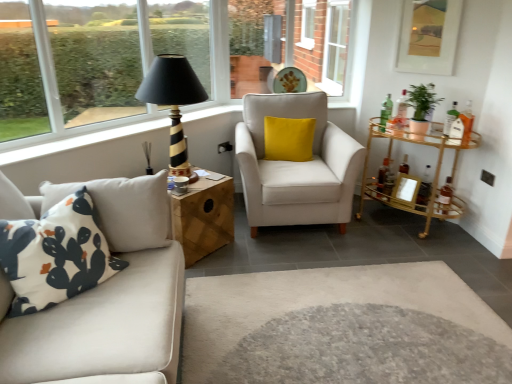
Measure the distance between yellow velvet pillow at center, which is the 2th pillow from left to right, and camera.

3.37 meters.

You are a GUI agent. You are given a task and a screenshot of the screen. Output one action in this format:
    pyautogui.click(x=<x>, y=<y>)
    Task: Click on the gold metallic bar cart at right, which is the 2th table in left-to-right order
    Image resolution: width=512 pixels, height=384 pixels.
    Given the screenshot: What is the action you would take?
    pyautogui.click(x=415, y=177)

This screenshot has width=512, height=384. Find the location of `wooden picture frame at right, arranged as the first picture frame when ordered from the bottom`. wooden picture frame at right, arranged as the first picture frame when ordered from the bottom is located at coordinates (405, 190).

Measure the distance between point (x=411, y=124) and camera.

Point (x=411, y=124) is 3.10 meters away from camera.

The height and width of the screenshot is (384, 512). I want to click on yellow velvet pillow at center, acting as the 2th pillow starting from the front, so click(x=289, y=139).

Can you confirm if green matte plant at upper right is bigger than wooden picture frame at right, acting as the 2th picture frame starting from the top?

Yes, green matte plant at upper right is bigger than wooden picture frame at right, acting as the 2th picture frame starting from the top.

From a real-world perspective, does green matte plant at upper right sit lower than wooden picture frame at right, arranged as the first picture frame when ordered from the bottom?

No, from a real-world perspective, green matte plant at upper right is not under wooden picture frame at right, arranged as the first picture frame when ordered from the bottom.

Is green matte plant at upper right not inside wooden picture frame at right, arranged as the first picture frame when ordered from the bottom?

Yes, green matte plant at upper right is outside of wooden picture frame at right, arranged as the first picture frame when ordered from the bottom.

Is there a large distance between green matte plant at upper right and wooden picture frame at right, arranged as the first picture frame when ordered from the bottom?

They are positioned close to each other.

Between white glass window at upper right, which ranks as the 2th window in back-to-front order, and wooden picture frame at right, acting as the 2th picture frame starting from the top, which one appears on the left side from the viewer's perspective?

white glass window at upper right, which ranks as the 2th window in back-to-front order.

Considering the positions of objects white glass window at upper right, which ranks as the 2th window in back-to-front order, and wooden picture frame at right, acting as the 2th picture frame starting from the top, in the image provided, who is in front, white glass window at upper right, which ranks as the 2th window in back-to-front order, or wooden picture frame at right, acting as the 2th picture frame starting from the top,?

wooden picture frame at right, acting as the 2th picture frame starting from the top.

Does point (346, 7) come farther from viewer compared to point (396, 184)?

Yes, point (346, 7) is farther from viewer.

Is wooden cube at center, the first table when ordered from left to right, at the back of black striped wood table lamp at upper center?

No, black striped wood table lamp at upper center's orientation is not away from wooden cube at center, the first table when ordered from left to right.

Looking at this image, from the image's perspective, which one is positioned lower, black striped wood table lamp at upper center or wooden cube at center, the first table when ordered from left to right?

From the image's view, wooden cube at center, the first table when ordered from left to right, is below.

Is black striped wood table lamp at upper center wider or thinner than wooden cube at center, the first table when ordered from left to right?

In the image, black striped wood table lamp at upper center appears to be more narrow than wooden cube at center, the first table when ordered from left to right.

From the picture: How many degrees apart are the facing directions of black striped wood table lamp at upper center and wooden cube at center, the first table when ordered from left to right?

0.000128 degrees.

Considering the relative positions of yellow velvet pillow at center, which ranks as the 2th pillow in bottom-to-top order, and wooden cube at center, the first table when ordered from left to right, in the image provided, is yellow velvet pillow at center, which ranks as the 2th pillow in bottom-to-top order, behind wooden cube at center, the first table when ordered from left to right,?

Yes, yellow velvet pillow at center, which ranks as the 2th pillow in bottom-to-top order, is further from the camera.

Is yellow velvet pillow at center, which is the 2th pillow from left to right, at the left side of wooden cube at center, marked as the 2th table in a right-to-left arrangement?

No.

Measure the distance from yellow velvet pillow at center, which is the 2th pillow from left to right, to wooden cube at center, marked as the 2th table in a right-to-left arrangement.

They are 83.15 centimeters apart.

Which of these two, yellow velvet pillow at center, marked as the first pillow in a top-to-bottom arrangement, or wooden cube at center, marked as the 2th table in a right-to-left arrangement, is thinner?

yellow velvet pillow at center, marked as the first pillow in a top-to-bottom arrangement, is thinner.

Does green matte plant at upper right have a greater height compared to matte gold picture frame at upper right, which ranks as the 1th picture frame in top-to-bottom order?

In fact, green matte plant at upper right may be shorter than matte gold picture frame at upper right, which ranks as the 1th picture frame in top-to-bottom order.

Is green matte plant at upper right to the right of matte gold picture frame at upper right, which is the 2th picture frame in bottom-to-top order, from the viewer's perspective?

No, green matte plant at upper right is not to the right of matte gold picture frame at upper right, which is the 2th picture frame in bottom-to-top order.

Is point (426, 110) farther from viewer compared to point (413, 9)?

No, it is not.

Relative to matte gold picture frame at upper right, which is the 2th picture frame in bottom-to-top order, is green matte plant at upper right in front or behind?

green matte plant at upper right is positioned closer to the viewer than matte gold picture frame at upper right, which is the 2th picture frame in bottom-to-top order.

From a real-world perspective, which object rests below the other?

wooden cube at center, marked as the 2th table in a right-to-left arrangement.

From the image's perspective, would you say wooden cube at center, the first table when ordered from left to right, is positioned over green matte plant at upper right?

Incorrect, from the image's perspective, wooden cube at center, the first table when ordered from left to right, is lower than green matte plant at upper right.

I want to click on houseplant above the wooden cube at center, marked as the 2th table in a right-to-left arrangement (from the image's perspective), so click(421, 106).

Which is behind, point (188, 221) or point (409, 127)?

The point (409, 127) is farther from the camera.

From a real-world perspective, relative to white fabric armchair at center, is white plastic window at upper center, which appears as the first window when viewed from the back, vertically above or below?

white plastic window at upper center, which appears as the first window when viewed from the back, is situated higher than white fabric armchair at center in the real world.

What's the angular difference between white plastic window at upper center, which appears as the first window when viewed from the back, and white fabric armchair at center's facing directions?

They differ by 90.8 degrees in their facing directions.

In the scene shown: Considering the relative sizes of white plastic window at upper center, the second window positioned from the front, and white fabric armchair at center in the image provided, is white plastic window at upper center, the second window positioned from the front, thinner than white fabric armchair at center?

Yes, white plastic window at upper center, the second window positioned from the front, is thinner than white fabric armchair at center.

Which point is more forward, (302, 12) or (320, 205)?

Point (320, 205)

The height and width of the screenshot is (384, 512). Find the location of `houseplant above the wooden picture frame at right, acting as the 2th picture frame starting from the top (from a real-world perspective)`. houseplant above the wooden picture frame at right, acting as the 2th picture frame starting from the top (from a real-world perspective) is located at coordinates (421, 106).

Where is `the 2nd picture frame below the white glass window at upper right, which ranks as the 2th window in back-to-front order (from the image's perspective)`? the 2nd picture frame below the white glass window at upper right, which ranks as the 2th window in back-to-front order (from the image's perspective) is located at coordinates (405, 190).

Looking at the image, which one is located closer to gold metallic bar cart at right, which is the 2th table in left-to-right order, black striped wood table lamp at upper center or white printed cushion at left, the 2th pillow in the back-to-front sequence?

black striped wood table lamp at upper center.

Looking at the image, which one is located closer to green matte plant at upper right, wooden picture frame at right, arranged as the first picture frame when ordered from the bottom, or white printed cushion at left, which appears as the second pillow when viewed from the right?

wooden picture frame at right, arranged as the first picture frame when ordered from the bottom, lies closer to green matte plant at upper right than the other object.

Based on their spatial positions, is matte gold picture frame at upper right, which is the 2th picture frame in bottom-to-top order, or white printed cushion at left, the 2th pillow in the back-to-front sequence, closer to yellow velvet pillow at center, which is the 1th pillow from back to front?

matte gold picture frame at upper right, which is the 2th picture frame in bottom-to-top order, is closer to yellow velvet pillow at center, which is the 1th pillow from back to front.

Based on their spatial positions, is white fabric armchair at center or yellow velvet pillow at center, acting as the 2th pillow starting from the front, closer to white glass window at upper right, which ranks as the 2th window in back-to-front order?

yellow velvet pillow at center, acting as the 2th pillow starting from the front, is positioned closer to the anchor white glass window at upper right, which ranks as the 2th window in back-to-front order.

From the image, which object appears to be nearer to wooden cube at center, marked as the 2th table in a right-to-left arrangement, wooden picture frame at right, acting as the 2th picture frame starting from the top, or white plastic window at upper center, which appears as the first window when viewed from the back?

wooden picture frame at right, acting as the 2th picture frame starting from the top.

Looking at the image, which one is located closer to matte gold picture frame at upper right, which ranks as the 1th picture frame in top-to-bottom order, white plastic window at upper center, which appears as the first window when viewed from the back, or white glass window at upper right, marked as the 1th window in a front-to-back arrangement?

white glass window at upper right, marked as the 1th window in a front-to-back arrangement.

Estimate the real-world distances between objects in this image. Which object is further from wooden cube at center, marked as the 2th table in a right-to-left arrangement, yellow velvet pillow at center, the 1th pillow from the right, or matte gold picture frame at upper right, which ranks as the 1th picture frame in top-to-bottom order?

matte gold picture frame at upper right, which ranks as the 1th picture frame in top-to-bottom order, is further to wooden cube at center, marked as the 2th table in a right-to-left arrangement.

Looking at the image, which one is located closer to matte gold picture frame at upper right, which ranks as the 1th picture frame in top-to-bottom order, white fabric armchair at center or wooden picture frame at right, acting as the 2th picture frame starting from the top?

The object closer to matte gold picture frame at upper right, which ranks as the 1th picture frame in top-to-bottom order, is wooden picture frame at right, acting as the 2th picture frame starting from the top.

Find the location of a particular element. chair situated between white printed cushion at left, marked as the 1th pillow in a bottom-to-top arrangement, and matte gold picture frame at upper right, which is the 2th picture frame in bottom-to-top order, from left to right is located at coordinates (296, 166).

Identify the location of pillow between green matte plant at upper right and white glass window at upper right, which ranks as the 2th window in back-to-front order, along the z-axis. (289, 139).

Find the location of a particular element. The height and width of the screenshot is (384, 512). picture frame positioned between matte gold picture frame at upper right, which is the 2th picture frame in bottom-to-top order, and white plastic window at upper center, the second window positioned from the front, from near to far is located at coordinates (405, 190).

Where is `picture frame located between white printed cushion at left, which appears as the second pillow when viewed from the right, and matte gold picture frame at upper right, which is the 2th picture frame in bottom-to-top order, in the left-right direction`? picture frame located between white printed cushion at left, which appears as the second pillow when viewed from the right, and matte gold picture frame at upper right, which is the 2th picture frame in bottom-to-top order, in the left-right direction is located at coordinates (405, 190).